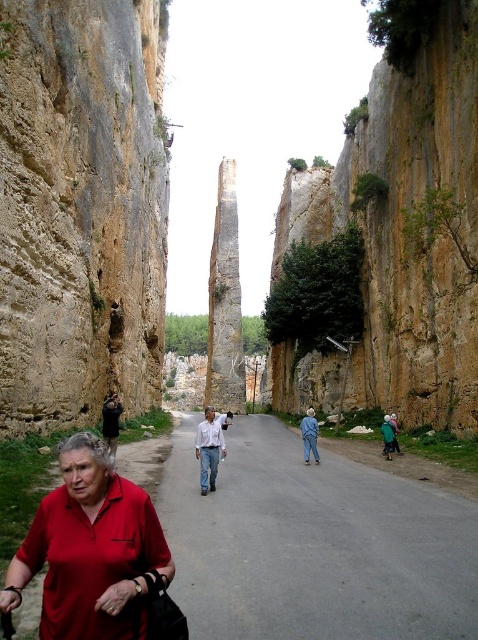
Between point (148, 497) and point (107, 406), which one is positioned behind?

Point (107, 406)

Is matte red shirt at lower left to the right of dark brown leather jacket at center from the viewer's perspective?

Yes, matte red shirt at lower left is to the right of dark brown leather jacket at center.

Where is `matte red shirt at lower left`? The width and height of the screenshot is (478, 640). matte red shirt at lower left is located at coordinates (90, 548).

Which is more to the right, brown rough cliff at center or light blue shirt at center?

From the viewer's perspective, brown rough cliff at center appears more on the right side.

The height and width of the screenshot is (640, 478). What are the coordinates of `brown rough cliff at center` in the screenshot? It's located at (410, 228).

At what (x,y) coordinates should I click in order to perform the action: click on brown rough cliff at center. Please return your answer as a coordinate pair (x, y). Looking at the image, I should click on (410, 228).

In the scene shown: Does smooth asphalt road at center appear over light blue shirt at center?

No, smooth asphalt road at center is not above light blue shirt at center.

Find the location of a particular element. smooth asphalt road at center is located at coordinates (314, 545).

The width and height of the screenshot is (478, 640). Describe the element at coordinates (314, 545) in the screenshot. I see `smooth asphalt road at center` at that location.

Where is `smooth asphalt road at center`? The image size is (478, 640). smooth asphalt road at center is located at coordinates (314, 545).